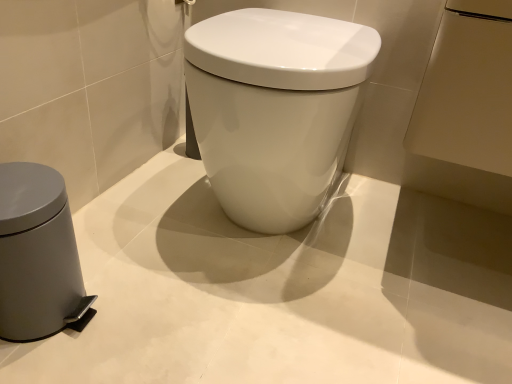
Question: Can you confirm if metallic silver towel bar at upper center is taller than white glossy toilet at center?

Choices:
 (A) yes
 (B) no

Answer: (B)

Question: Is metallic silver towel bar at upper center aimed at white glossy toilet at center?

Choices:
 (A) no
 (B) yes

Answer: (B)

Question: Does metallic silver towel bar at upper center appear on the left side of white glossy toilet at center?

Choices:
 (A) no
 (B) yes

Answer: (B)

Question: Is metallic silver towel bar at upper center directly adjacent to white glossy toilet at center?

Choices:
 (A) yes
 (B) no

Answer: (B)

Question: From a real-world perspective, is metallic silver towel bar at upper center positioned over white glossy toilet at center based on gravity?

Choices:
 (A) no
 (B) yes

Answer: (B)

Question: Is metallic silver towel bar at upper center to the right of white glossy toilet at center from the viewer's perspective?

Choices:
 (A) yes
 (B) no

Answer: (B)

Question: Can you confirm if metallic silver towel bar at upper center is wider than gray matte waste container at left?

Choices:
 (A) no
 (B) yes

Answer: (A)

Question: Can you confirm if metallic silver towel bar at upper center is smaller than gray matte waste container at left?

Choices:
 (A) no
 (B) yes

Answer: (B)

Question: Considering the relative positions of metallic silver towel bar at upper center and gray matte waste container at left in the image provided, is metallic silver towel bar at upper center to the right of gray matte waste container at left from the viewer's perspective?

Choices:
 (A) yes
 (B) no

Answer: (A)

Question: Is the depth of metallic silver towel bar at upper center less than that of gray matte waste container at left?

Choices:
 (A) no
 (B) yes

Answer: (A)

Question: Are metallic silver towel bar at upper center and gray matte waste container at left located far from each other?

Choices:
 (A) no
 (B) yes

Answer: (A)

Question: Is metallic silver towel bar at upper center shorter than gray matte waste container at left?

Choices:
 (A) no
 (B) yes

Answer: (B)

Question: Can you confirm if gray matte waste container at left is thinner than white glossy toilet at center?

Choices:
 (A) no
 (B) yes

Answer: (B)